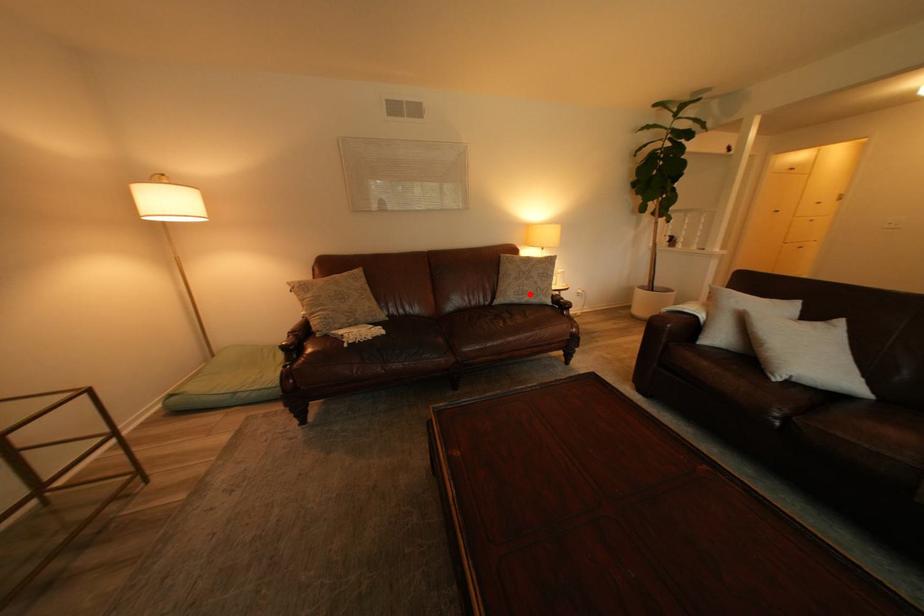
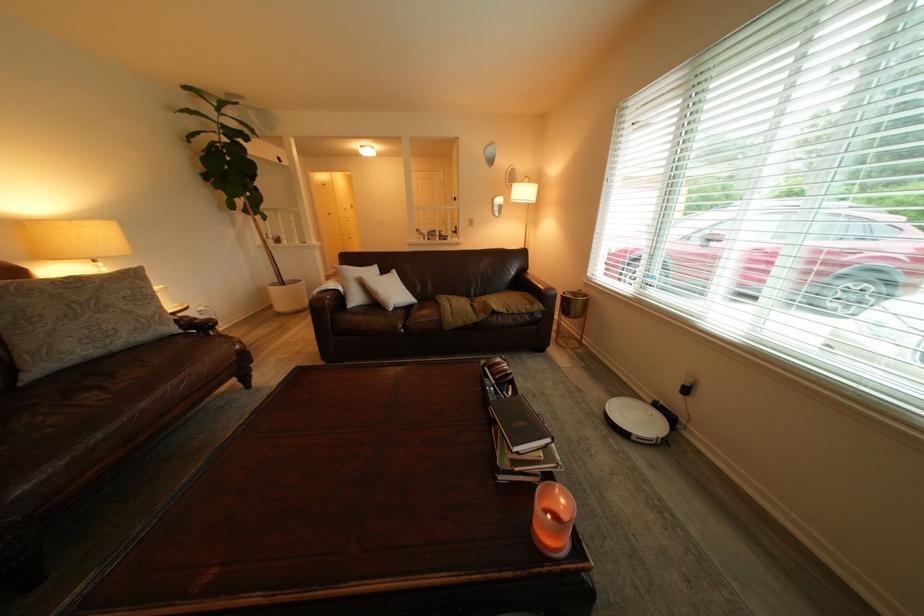
Where in the second image is the point corresponding to the highlighted location from the first image?

(101, 342)